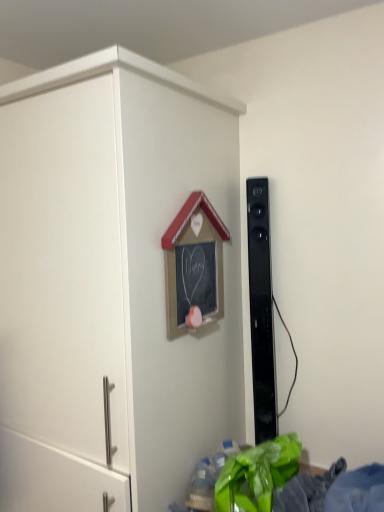
Question: Is black glossy speaker at right to the left of white matte cupboard at center from the viewer's perspective?

Choices:
 (A) yes
 (B) no

Answer: (B)

Question: Is black glossy speaker at right wider than white matte cupboard at center?

Choices:
 (A) yes
 (B) no

Answer: (B)

Question: Can you see black glossy speaker at right touching white matte cupboard at center?

Choices:
 (A) yes
 (B) no

Answer: (B)

Question: From the image's perspective, is black glossy speaker at right below white matte cupboard at center?

Choices:
 (A) yes
 (B) no

Answer: (B)

Question: Does black glossy speaker at right come in front of white matte cupboard at center?

Choices:
 (A) yes
 (B) no

Answer: (B)

Question: Is black glossy speaker at right bigger than white matte cupboard at center?

Choices:
 (A) no
 (B) yes

Answer: (A)

Question: Considering the relative sizes of white matte cupboard at center and black glossy speaker at right in the image provided, is white matte cupboard at center thinner than black glossy speaker at right?

Choices:
 (A) no
 (B) yes

Answer: (A)

Question: From a real-world perspective, is white matte cupboard at center positioned under black glossy speaker at right based on gravity?

Choices:
 (A) no
 (B) yes

Answer: (B)

Question: From the image's perspective, is white matte cupboard at center over black glossy speaker at right?

Choices:
 (A) no
 (B) yes

Answer: (A)

Question: Is white matte cupboard at center further to camera compared to black glossy speaker at right?

Choices:
 (A) no
 (B) yes

Answer: (A)

Question: Can you confirm if white matte cupboard at center is positioned to the left of black glossy speaker at right?

Choices:
 (A) yes
 (B) no

Answer: (A)

Question: Does white matte cupboard at center have a smaller size compared to black glossy speaker at right?

Choices:
 (A) yes
 (B) no

Answer: (B)

Question: From the image's perspective, is black glossy speaker at right located above or below white matte cupboard at center?

Choices:
 (A) below
 (B) above

Answer: (B)